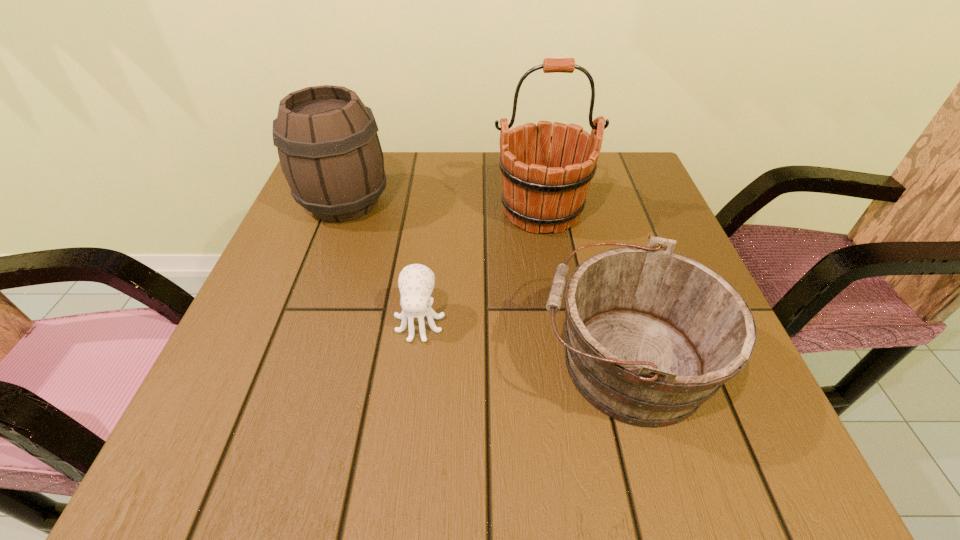
You are a GUI agent. You are given a task and a screenshot of the screen. Output one action in this format:
    pyautogui.click(x=<x>, y=<y>)
    Task: Click on the vacant space located 0.120m on the front-facing side of the third object from right to left
    
    Given the screenshot: What is the action you would take?
    pyautogui.click(x=409, y=409)

I want to click on object at the near edge, so click(651, 335).

I want to click on object that is at the left edge, so click(330, 154).

Locate an element on the screen. object that is at the right edge is located at coordinates click(x=651, y=335).

Identify the location of object at the far left corner. (330, 154).

The width and height of the screenshot is (960, 540). In order to click on object located at the near right corner in this screenshot , I will do [651, 335].

The height and width of the screenshot is (540, 960). Find the location of `blank space at the far edge`. blank space at the far edge is located at coordinates (468, 157).

Identify the location of vacant space at the near edge. (414, 459).

In the image, there is a desktop. At what (x,y) coordinates should I click in order to perform the action: click on vacant space at the left edge. Please return your answer as a coordinate pair (x, y). Looking at the image, I should click on (233, 389).

This screenshot has height=540, width=960. What are the coordinates of `free point at the right edge` in the screenshot? It's located at (626, 211).